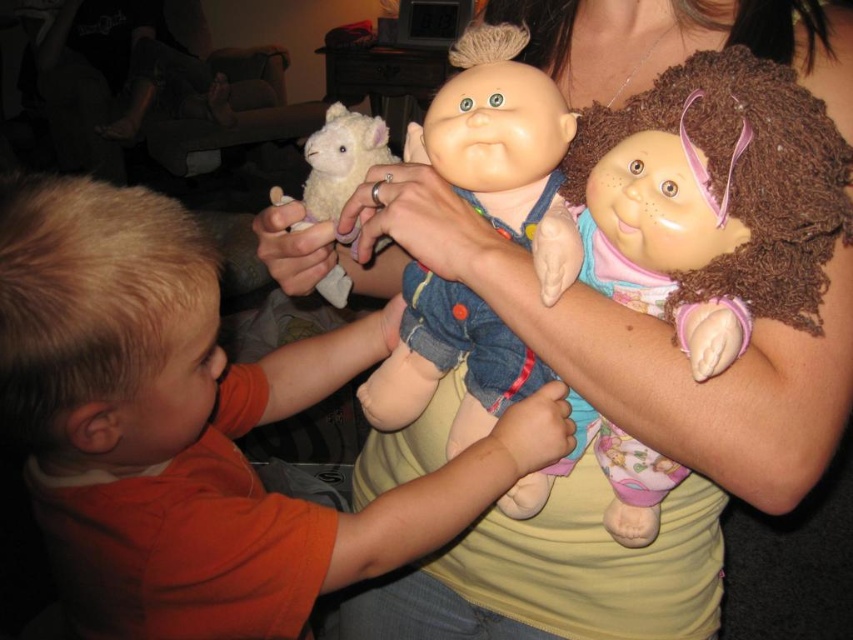
Question: Is smooth plastic dolls at center positioned at the back of smooth plastic doll at center?

Choices:
 (A) no
 (B) yes

Answer: (A)

Question: Is smooth plastic dolls at center above fluffy white lamb at center?

Choices:
 (A) no
 (B) yes

Answer: (A)

Question: Estimate the real-world distances between objects in this image. Which object is farther from the orange cotton shirt at left?

Choices:
 (A) smooth plastic doll at center
 (B) smooth plastic dolls at center
 (C) fluffy white lamb at center

Answer: (C)

Question: Can you confirm if smooth plastic dolls at center is wider than smooth plastic doll at center?

Choices:
 (A) yes
 (B) no

Answer: (A)

Question: Which of the following is the farthest from the observer?

Choices:
 (A) orange cotton shirt at left
 (B) smooth plastic doll at center
 (C) fluffy white lamb at center
 (D) smooth plastic dolls at center

Answer: (C)

Question: Among these points, which one is farthest from the camera?

Choices:
 (A) (331, 188)
 (B) (509, 67)
 (C) (656, 496)
 (D) (457, 520)

Answer: (A)